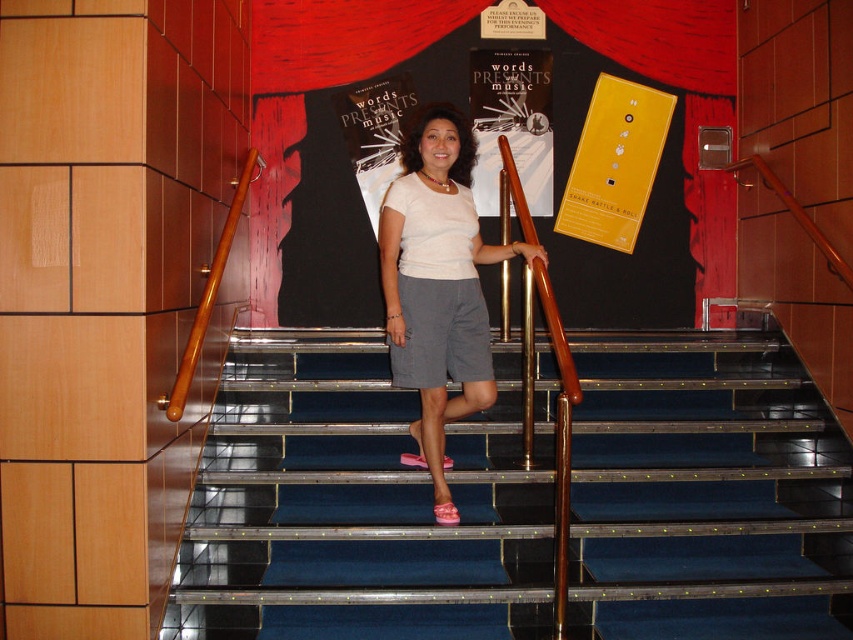
Question: Considering the relative positions of yellow matte poster at upper center and matte paper poster at center in the image provided, where is yellow matte poster at upper center located with respect to matte paper poster at center?

Choices:
 (A) above
 (B) below

Answer: (B)

Question: Which point is closer to the camera?

Choices:
 (A) tap(544, 131)
 (B) tap(640, 516)
 (C) tap(444, 385)

Answer: (C)

Question: Is matte white blouse at center positioned in front of yellow matte poster at upper center?

Choices:
 (A) no
 (B) yes

Answer: (B)

Question: Which point is farther to the camera?

Choices:
 (A) yellow matte poster at upper center
 (B) blue carpeted stairs at center
 (C) gray cotton shorts at center

Answer: (A)

Question: Which point appears farthest from the camera in this image?

Choices:
 (A) (567, 189)
 (B) (479, 196)
 (C) (409, 378)

Answer: (A)

Question: Does matte white blouse at center have a greater width compared to gray cotton shorts at center?

Choices:
 (A) no
 (B) yes

Answer: (B)